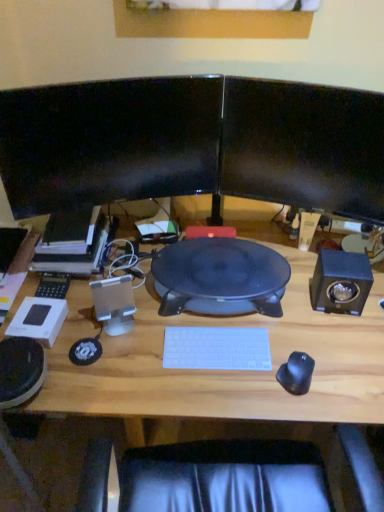
You are a GUI agent. You are given a task and a screenshot of the screen. Output one action in this format:
    pyautogui.click(x=<x>, y=<y>)
    Task: Click on the free space between black rubberized mouse at right and white plastic keyboard at center
    
    Given the screenshot: What is the action you would take?
    pyautogui.click(x=247, y=374)